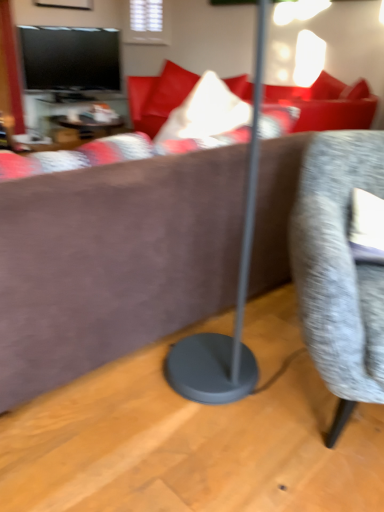
Question: Is wooden table at center to the left of textured gray chair at right from the viewer's perspective?

Choices:
 (A) yes
 (B) no

Answer: (A)

Question: Is wooden table at center to the right of textured gray chair at right from the viewer's perspective?

Choices:
 (A) no
 (B) yes

Answer: (A)

Question: Could you tell me if wooden table at center is turned towards textured gray chair at right?

Choices:
 (A) no
 (B) yes

Answer: (B)

Question: Does wooden table at center have a greater width compared to textured gray chair at right?

Choices:
 (A) no
 (B) yes

Answer: (A)

Question: From a real-world perspective, is wooden table at center below textured gray chair at right?

Choices:
 (A) yes
 (B) no

Answer: (A)

Question: Considering the positions of wooden table at center and brown suede couch at center in the image, is wooden table at center bigger or smaller than brown suede couch at center?

Choices:
 (A) big
 (B) small

Answer: (B)

Question: From a real-world perspective, is wooden table at center above or below brown suede couch at center?

Choices:
 (A) below
 (B) above

Answer: (A)

Question: In terms of width, does wooden table at center look wider or thinner when compared to brown suede couch at center?

Choices:
 (A) wide
 (B) thin

Answer: (B)

Question: Does point [x=97, y=111] appear closer or farther from the camera than point [x=195, y=155]?

Choices:
 (A) closer
 (B) farther

Answer: (B)

Question: Considering the positions of point (355, 377) and point (279, 220), is point (355, 377) closer or farther from the camera than point (279, 220)?

Choices:
 (A) farther
 (B) closer

Answer: (B)

Question: Is textured gray chair at right spatially inside brown suede couch at center, or outside of it?

Choices:
 (A) outside
 (B) inside

Answer: (A)

Question: Is textured gray chair at right wider or thinner than brown suede couch at center?

Choices:
 (A) wide
 (B) thin

Answer: (A)

Question: In terms of size, does textured gray chair at right appear bigger or smaller than brown suede couch at center?

Choices:
 (A) small
 (B) big

Answer: (B)

Question: From a real-world perspective, is textured gray chair at right above or below wooden table at center?

Choices:
 (A) below
 (B) above

Answer: (B)

Question: Considering the positions of textured gray chair at right and wooden table at center in the image, is textured gray chair at right taller or shorter than wooden table at center?

Choices:
 (A) tall
 (B) short

Answer: (A)